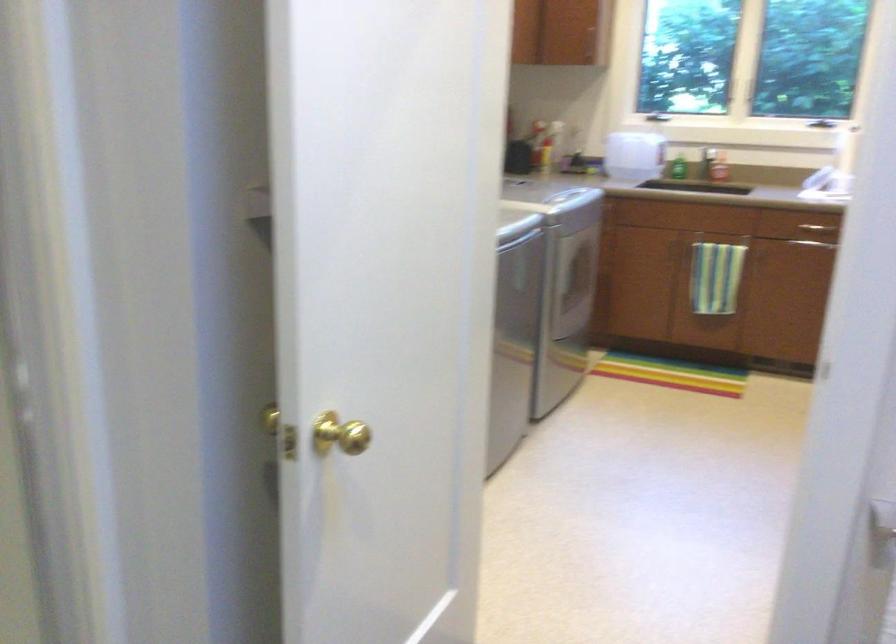
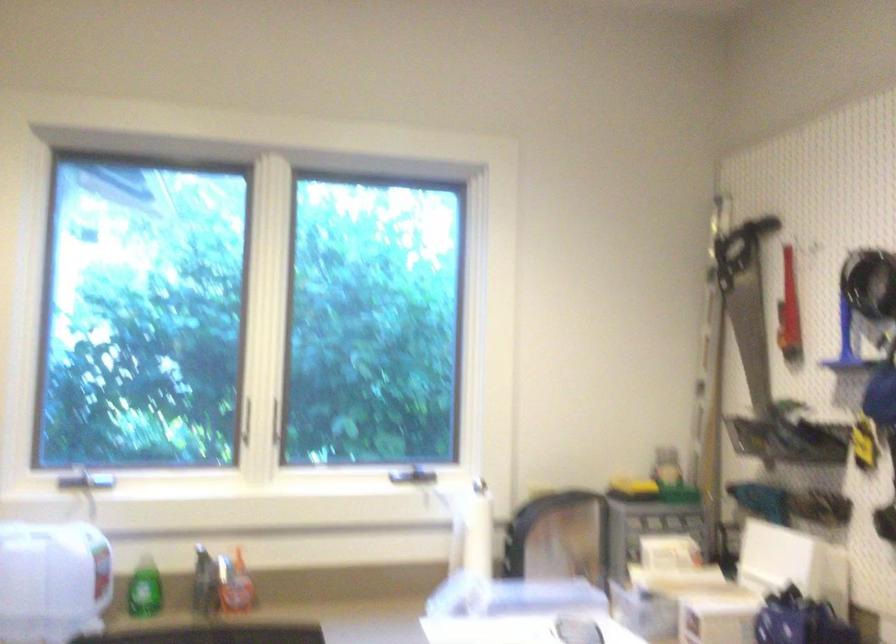
In the second image, find the point that corresponds to [703,158] in the first image.

(204, 583)